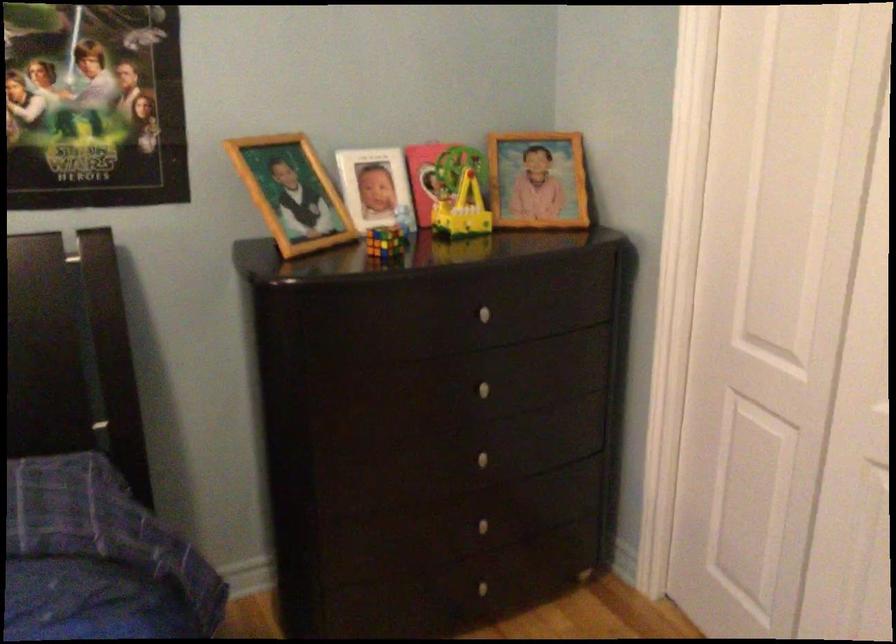
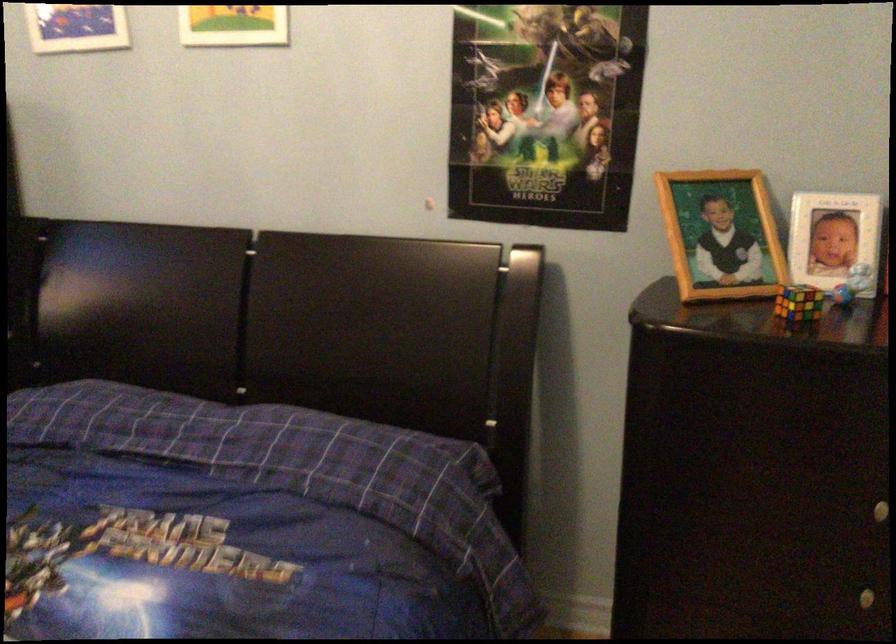
In the second image, find the point that corresponds to pixel 294 190 in the first image.

(720, 234)